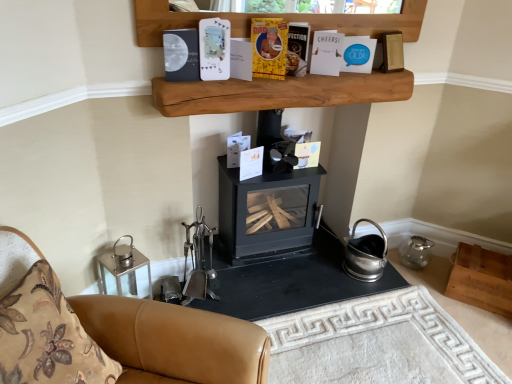
Identify the location of vacant space situated above wooden box at lower right, the second shelf viewed from the left (from a real-world perspective). (490, 261).